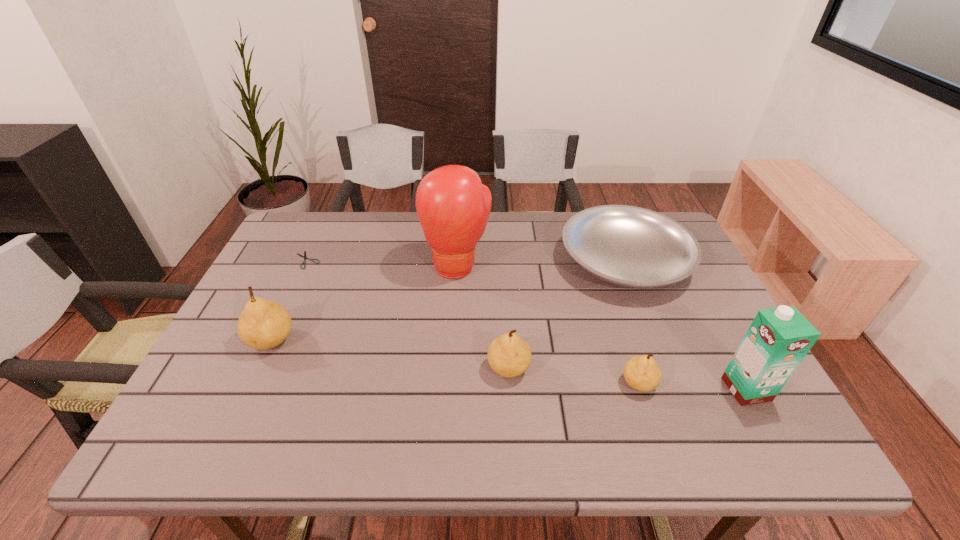
Find the location of `unoccupied area between the carton and the tallest object`. unoccupied area between the carton and the tallest object is located at coordinates (602, 328).

Where is `blank region between the rightmost pear and the leftmost pear`? This screenshot has height=540, width=960. blank region between the rightmost pear and the leftmost pear is located at coordinates (455, 362).

This screenshot has height=540, width=960. Identify the location of free space between the tallest object and the carton. 602,328.

You are a GUI agent. You are given a task and a screenshot of the screen. Output one action in this format:
    pyautogui.click(x=<x>, y=<y>)
    Task: Click on the object that is the fourth closest one to the shears
    The image size is (960, 540).
    Given the screenshot: What is the action you would take?
    pyautogui.click(x=629, y=246)

Select which object is the third closest to the second shortest object. Please provide its 2D coordinates. Your answer should be formatted as a tuple, i.e. [(x, y)], where the tuple contains the x and y coordinates of a point satisfying the conditions above.

[(453, 206)]

Find the location of `pear that stands as the second closest to the fourth shortest object`. pear that stands as the second closest to the fourth shortest object is located at coordinates (263, 324).

The width and height of the screenshot is (960, 540). Find the location of `pear that is the closest one to the tallest object`. pear that is the closest one to the tallest object is located at coordinates (x=508, y=355).

Locate an element on the screen. The width and height of the screenshot is (960, 540). free spot that satisfies the following two spatial constraints: 1. on the striking surface of the tallest object; 2. on the right side of the second shortest pear is located at coordinates (451, 368).

The image size is (960, 540). What are the coordinates of `free space that satisfies the following two spatial constraints: 1. on the striking surface of the tallest object; 2. on the right side of the carton` in the screenshot? It's located at (450, 389).

Locate an element on the screen. Image resolution: width=960 pixels, height=540 pixels. free space that satisfies the following two spatial constraints: 1. on the striking surface of the tallest object; 2. on the right side of the second pear from left to right is located at coordinates (451, 368).